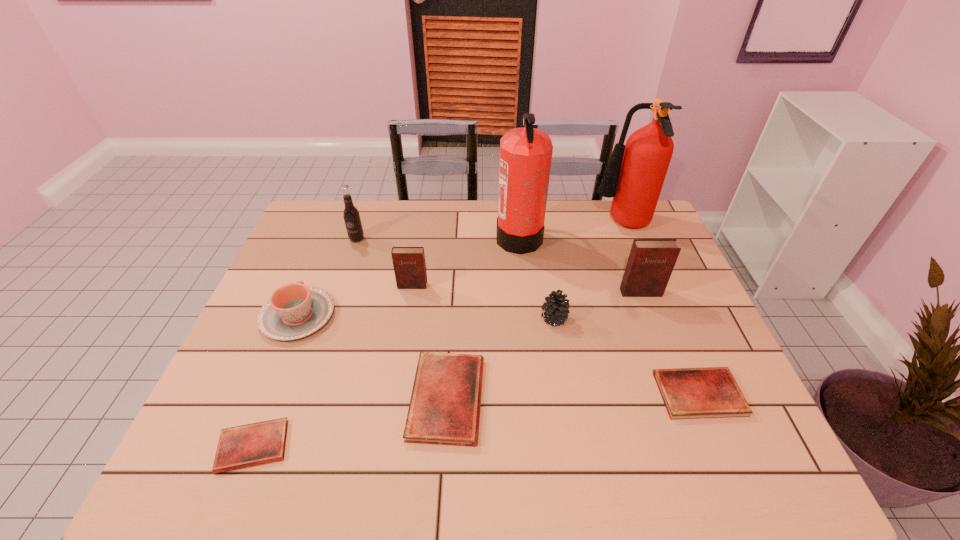
At what (x,y) coordinates should I click in order to perform the action: click on vacant space situated at the nozzle of the right fire extinguisher. Please return your answer as a coordinate pair (x, y). Looking at the image, I should click on (490, 225).

You are a GUI agent. You are given a task and a screenshot of the screen. Output one action in this format:
    pyautogui.click(x=<x>, y=<y>)
    Task: Click on the vacant space positioned 0.270m at the nozzle of the right fire extinguisher
    This screenshot has height=540, width=960.
    Given the screenshot: What is the action you would take?
    pyautogui.click(x=513, y=225)

The width and height of the screenshot is (960, 540). I want to click on vacant region located 0.320m at the nozzle of the right fire extinguisher, so click(498, 225).

This screenshot has height=540, width=960. In order to click on vacant space located 0.120m on the label of the root beer in this screenshot , I will do `click(348, 268)`.

This screenshot has height=540, width=960. What are the coordinates of `vacant space located 0.160m on the front cover of the bigger reddish-brown diary` in the screenshot? It's located at (659, 341).

The image size is (960, 540). Identify the location of vacant position located on the front cover of the smaller reddish-brown diary. (393, 409).

The image size is (960, 540). I want to click on vacant space situated 0.390m on the back of the fifth shortest object, so click(x=539, y=225).

Where is `free space located on the handle side of the seventh tallest object`? free space located on the handle side of the seventh tallest object is located at coordinates pyautogui.click(x=329, y=237).

Locate an element on the screen. blank area located on the handle side of the seventh tallest object is located at coordinates (332, 230).

In order to click on vacant area situated 0.350m on the handle side of the seventh tallest object in this screenshot , I will do tap(337, 220).